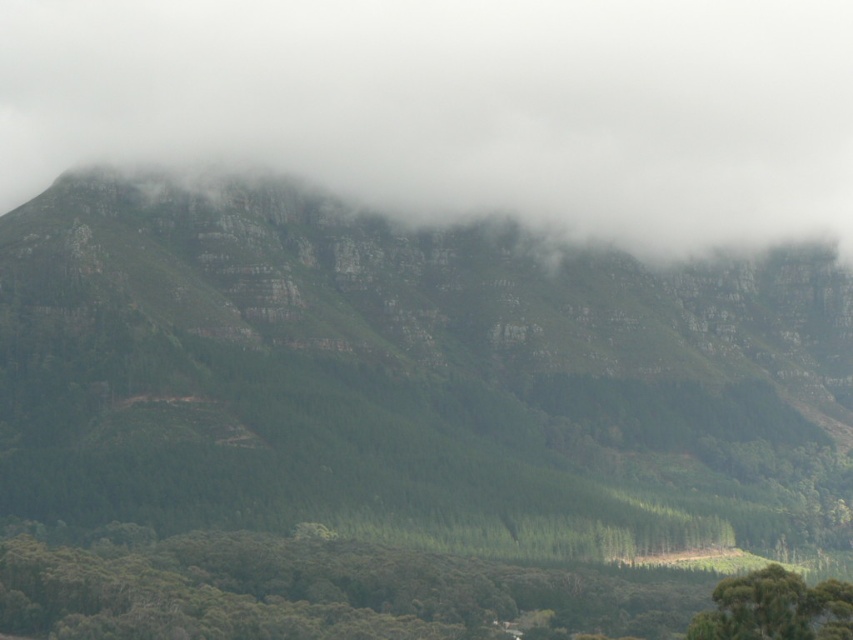
You are an airplane passenger looking out the window and see the white fluffy cloud at upper center and the green matte forest at lower center. Which object is positioned to the left when viewed from your perspective?

The white fluffy cloud at upper center is to the left of the green matte forest at lower center.